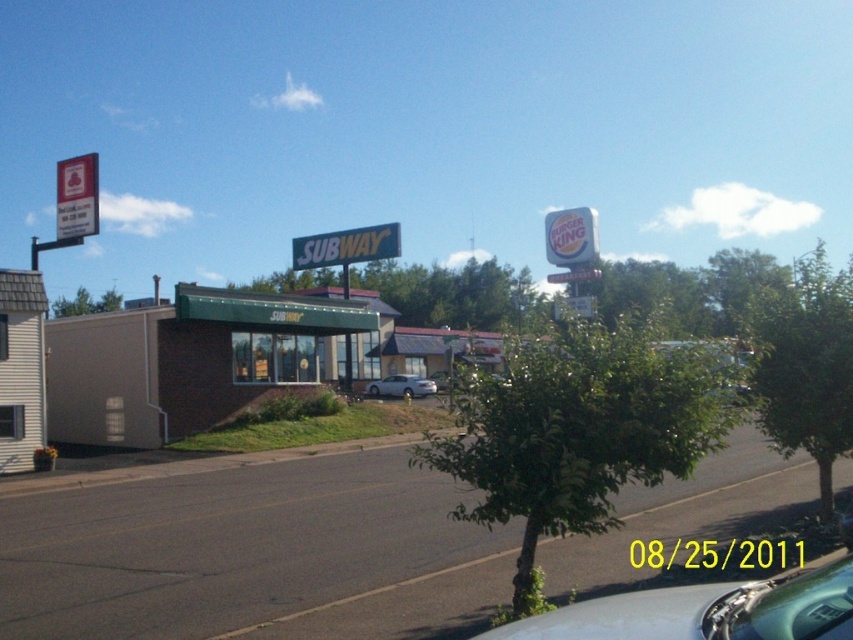
How much distance is there between blue plastic sign at center and white plastic sign at upper left?

They are 100.56 feet apart.

From the picture: Who is more distant from viewer, (370, 252) or (90, 170)?

The point (370, 252) is behind.

Which is behind, point (312, 236) or point (85, 176)?

Positioned behind is point (312, 236).

This screenshot has width=853, height=640. I want to click on blue plastic sign at center, so click(x=346, y=246).

Which is below, metallic silver car at center or white plastic sign at upper center?

Positioned lower is metallic silver car at center.

Is metallic silver car at center thinner than white plastic sign at upper center?

Indeed, metallic silver car at center has a lesser width compared to white plastic sign at upper center.

Which is in front, point (648, 618) or point (589, 228)?

Point (648, 618)

I want to click on metallic silver car at center, so click(x=706, y=611).

Is white plastic sign at upper left taller than silver metallic sedan at center?

Indeed, white plastic sign at upper left has a greater height compared to silver metallic sedan at center.

Between white plastic sign at upper left and silver metallic sedan at center, which one has less height?

With less height is silver metallic sedan at center.

Is point (67, 237) closer to viewer compared to point (403, 378)?

Yes, it is.

Find the location of a particular element. The height and width of the screenshot is (640, 853). white plastic sign at upper left is located at coordinates (76, 196).